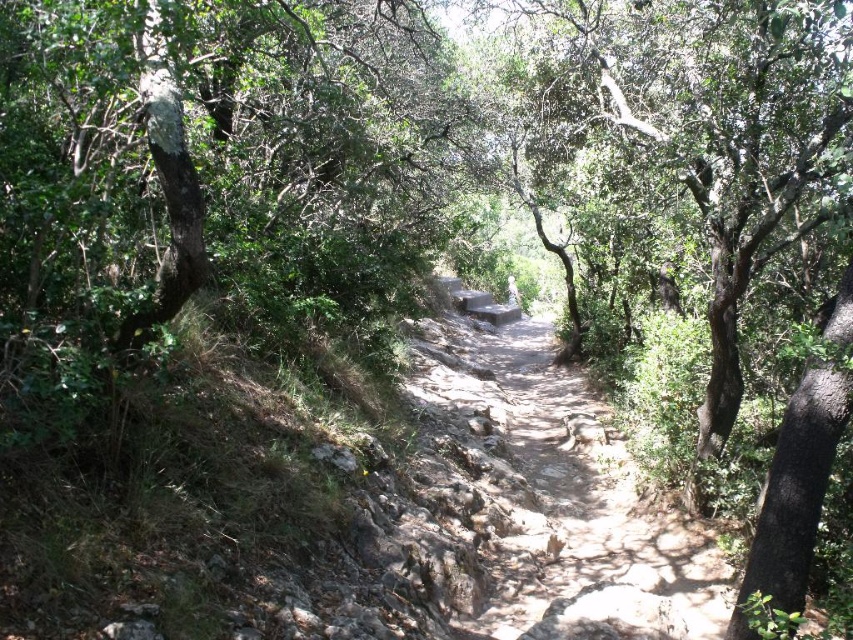
You are a hiker standing on the dirt path at center and want to take a photo of the green leafy tree at center. Since both are at the center, which one should you focus on to ensure the tree is in sharp focus?

You should focus on the green leafy tree at center because it is closer to the viewer than the dirt path at center, so focusing on the tree will keep it sharp while the path may be slightly out of focus.

You are a hiker standing at the start of a rocky path in a dense forest. You see a point marked at coordinates (618, 52). Can you estimate how far this point is from your current position?

The point at (618, 52) is 12.61 meters away from the viewer, so the distance is approximately 12.61 meters.

You are a hiker standing at the start of the dirt path at center. You want to reach a viewpoint located beyond the green leafy tree at center. Considering the height difference between the tree and the path, can you see the viewpoint from your current position?

The green leafy tree at center is taller than the dirt path at center. Since the tree is taller, it might block your view of the viewpoint beyond it. You may need to move to a higher position or around the tree to see the viewpoint.